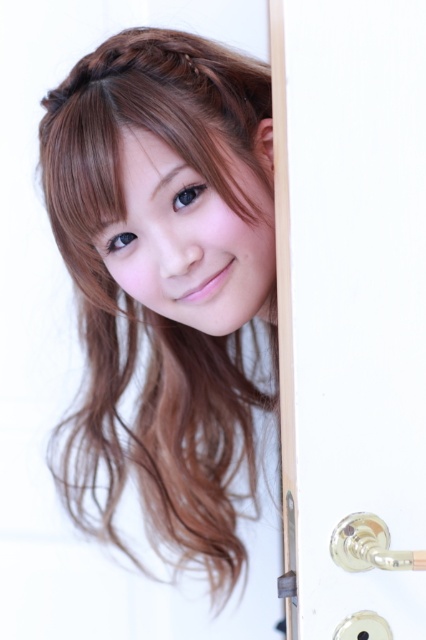
Question: Which point is closer to the camera?

Choices:
 (A) silver metallic door handle at lower right
 (B) smooth brown hair at center

Answer: (A)

Question: Which point appears closest to the camera in this image?

Choices:
 (A) (342, 632)
 (B) (356, 564)

Answer: (B)

Question: Based on their relative distances, which object is nearer to the gold metallic lock at right?

Choices:
 (A) gold metallic door handle at right
 (B) smooth brown hair at center
 (C) silver metallic door handle at lower right

Answer: (C)

Question: Is gold metallic door handle at right smaller than silver metallic door handle at lower right?

Choices:
 (A) no
 (B) yes

Answer: (A)

Question: Does silver metallic door handle at lower right have a lesser width compared to gold metallic lock at right?

Choices:
 (A) no
 (B) yes

Answer: (A)

Question: Is smooth brown hair at center to the right of silver metallic door handle at lower right from the viewer's perspective?

Choices:
 (A) no
 (B) yes

Answer: (A)